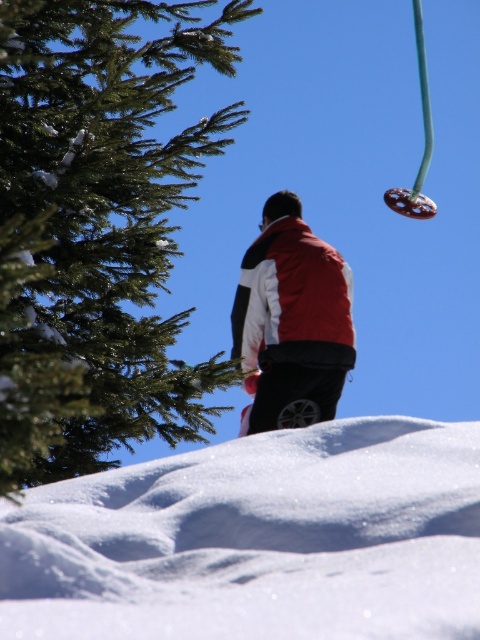
You are standing at the bottom of the slope and want to walk towards the white powdery snow at center. Which direction should you go?

You should walk towards the center of the slope where the white powdery snow at center is located, which is at coordinates point (257, 540).

You are a photographer holding a camera that is 0.5 meters wide. You want to capture a wide shot of the white powdery snow at center without any obstructions. Since you are standing on the snow, can you move your feet apart enough to position the camera so it doesn t block the snow?

The distance between the white powdery snow at center and the camera is 1.56 meters. Since the camera is only 0.5 meters wide, you can easily spread your legs to position the camera sideways without blocking the snow as the space is more than enough.

You are a winter sports enthusiast planning to ski down the slope. You see the white powdery snow at center and the green textured pine tree at left. Which object is positioned higher on the slope?

The green textured pine tree at left is positioned higher on the slope than the white powdery snow at center.